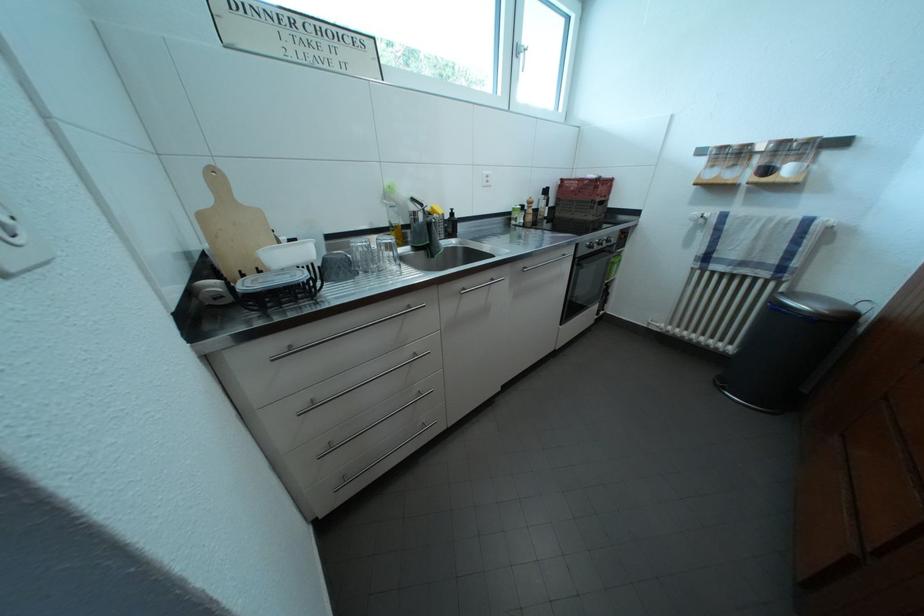
Describe the element at coordinates (815, 306) in the screenshot. I see `the stainless steel lid` at that location.